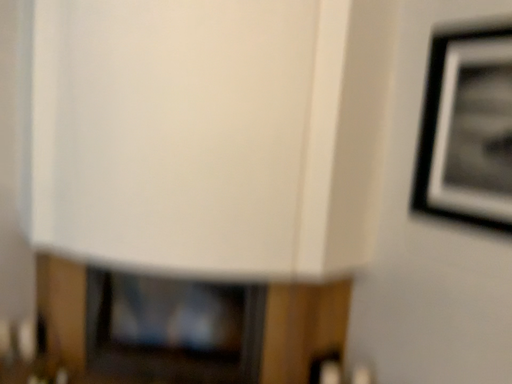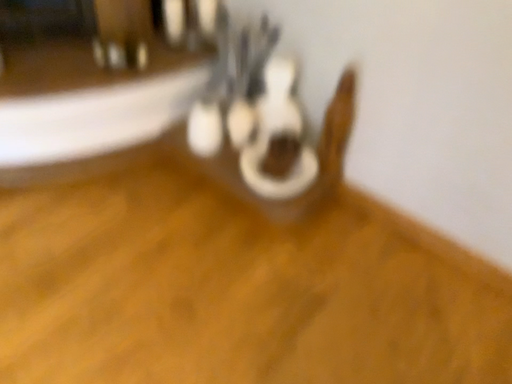
Question: Which way did the camera rotate in the video?

Choices:
 (A) rotated left
 (B) rotated right

Answer: (B)